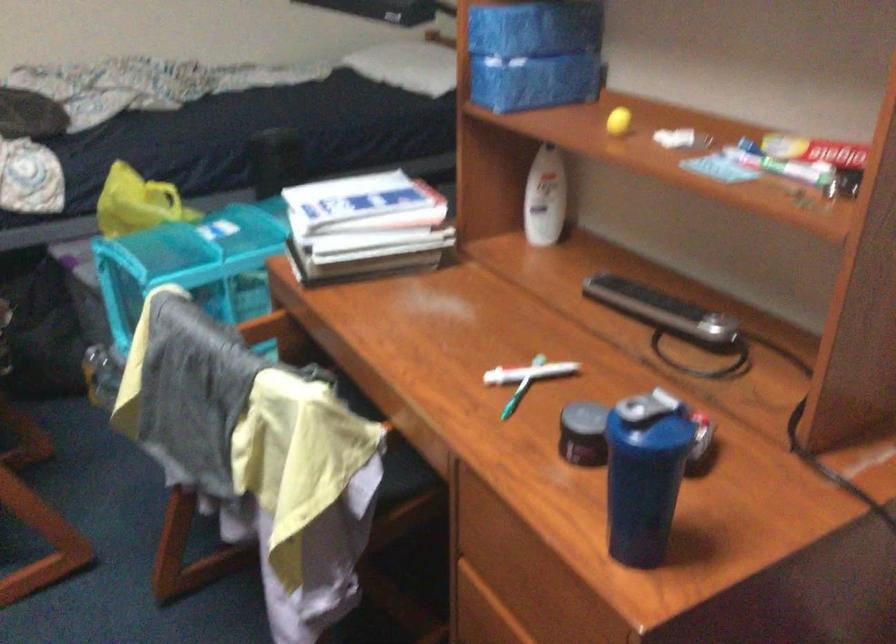
Image resolution: width=896 pixels, height=644 pixels. What do you see at coordinates (650, 410) in the screenshot?
I see `the shaker cup cap` at bounding box center [650, 410].